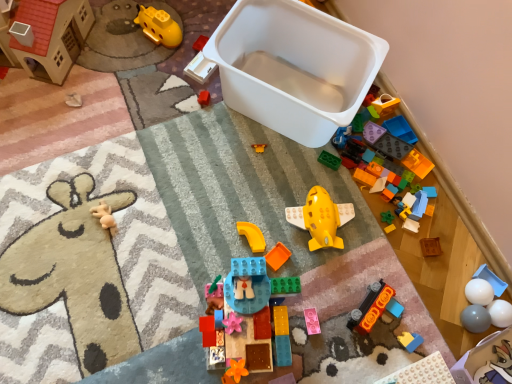
Where is `vacant area that lies between matte plastic toy at lower right, which is counted as the 12th toy, starting from the left, and yellow matte airplane at center, the 8th toy from the left`? This screenshot has height=384, width=512. vacant area that lies between matte plastic toy at lower right, which is counted as the 12th toy, starting from the left, and yellow matte airplane at center, the 8th toy from the left is located at coordinates (355, 275).